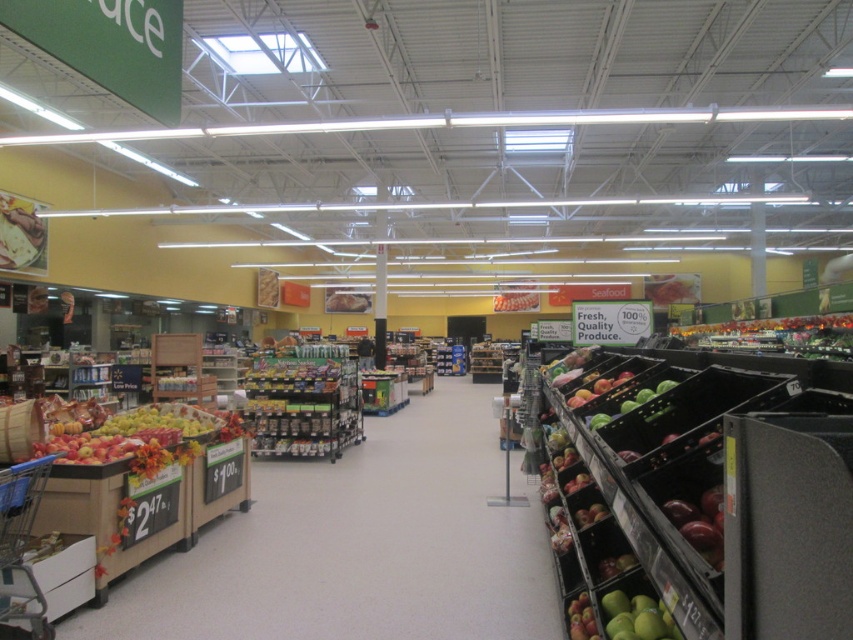
Is wooden crate apples at left to the left of shiny red apple at lower right from the viewer's perspective?

Yes, wooden crate apples at left is to the left of shiny red apple at lower right.

Is point (338, 529) more distant than point (715, 557)?

That is True.

Is point (535, 634) positioned before point (712, 524)?

No, (535, 634) is further to viewer.

Where is `wooden crate apples at left`? This screenshot has height=640, width=853. wooden crate apples at left is located at coordinates (360, 545).

Is wooden crate apples at left to the left of green matte apples at center from the viewer's perspective?

Correct, you'll find wooden crate apples at left to the left of green matte apples at center.

Who is positioned more to the left, wooden crate apples at left or green matte apples at center?

wooden crate apples at left

Is point (405, 419) positioned after point (628, 540)?

Yes, it is behind point (628, 540).

The image size is (853, 640). What are the coordinates of `wooden crate apples at left` in the screenshot? It's located at (360, 545).

Describe the element at coordinates (360, 545) in the screenshot. The width and height of the screenshot is (853, 640). I see `wooden crate apples at left` at that location.

Is the position of wooden crate apples at left less distant than that of green matte apples at lower right?

No, wooden crate apples at left is further to the viewer.

What do you see at coordinates (360, 545) in the screenshot?
I see `wooden crate apples at left` at bounding box center [360, 545].

At what (x,y) coordinates should I click in order to perform the action: click on wooden crate apples at left. Please return your answer as a coordinate pair (x, y). Looking at the image, I should click on (360, 545).